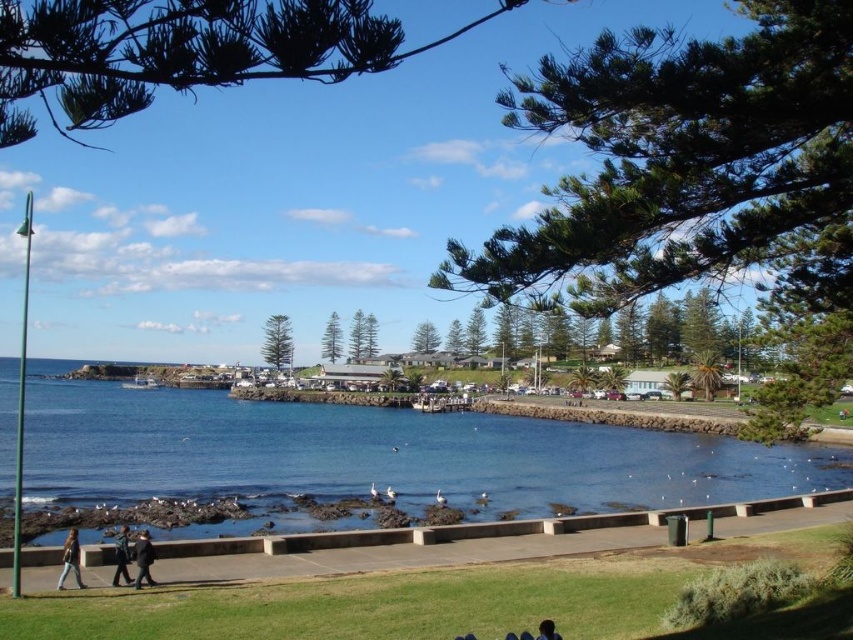
Question: In this image, where is blue water at center located relative to denim jacket at lower left?

Choices:
 (A) above
 (B) below

Answer: (B)

Question: Which object is closer to the camera taking this photo?

Choices:
 (A) denim jacket at lower left
 (B) dark gray jacket at lower left
 (C) dark blue jeans at lower left

Answer: (A)

Question: Does blue water at center have a greater width compared to dark blue jeans at lower left?

Choices:
 (A) yes
 (B) no

Answer: (A)

Question: Can you confirm if denim jacket at lower left is positioned above dark gray jacket at lower left?

Choices:
 (A) no
 (B) yes

Answer: (B)

Question: Among these points, which one is farthest from the camera?

Choices:
 (A) click(77, 548)
 (B) click(125, 534)
 (C) click(196, 468)
 (D) click(538, 625)

Answer: (C)

Question: Which point appears closest to the camera in this image?

Choices:
 (A) (77, 580)
 (B) (552, 627)

Answer: (B)